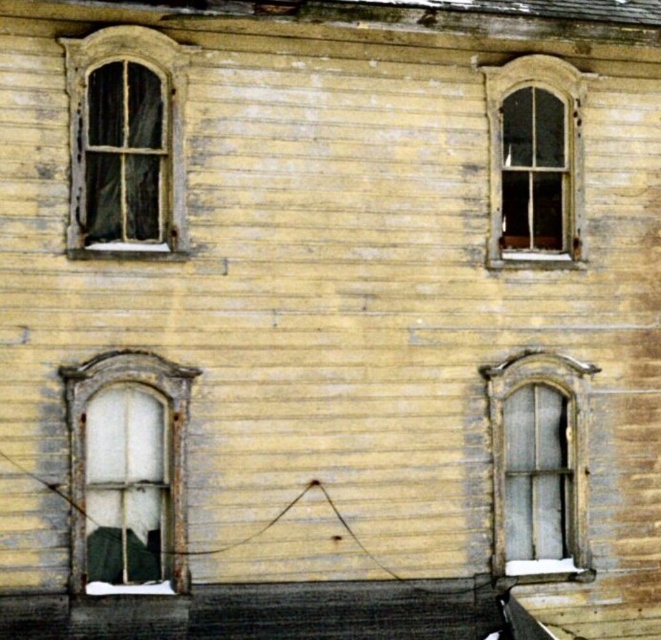
You are an architect inspecting the building facade. You notice the translucent glass window at center and the matte gray glass window at lower right. Which window has a larger surface area?

The matte gray glass window at lower right has a larger surface area than the translucent glass window at center.

You are standing in front of the old wooden building and want to touch both the point at location (100, 360) and the point at (537, 198). Which point will require you to reach further out?

The point at (537, 198) requires reaching further because it is farther from the camera compared to the point at (100, 360).